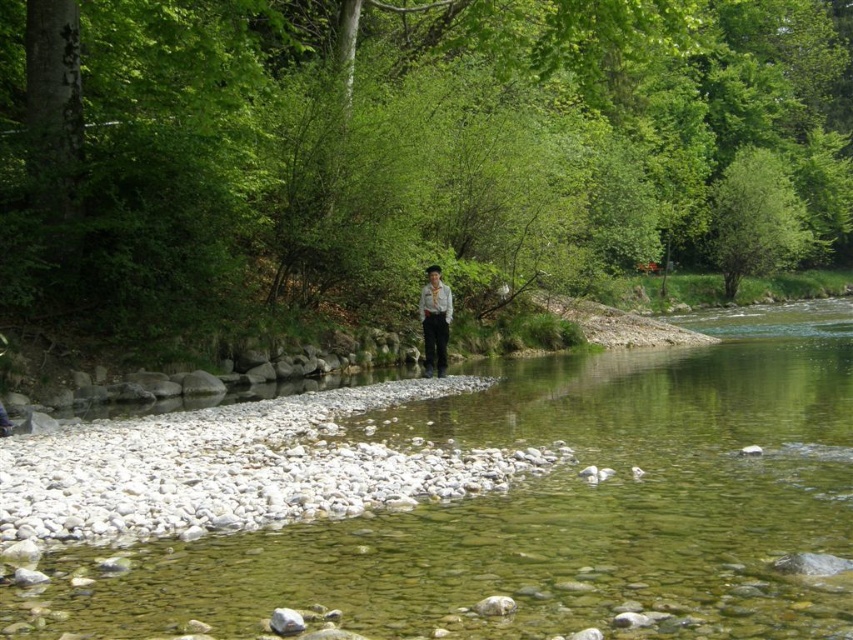
Question: Does clear water at center lie in front of light brown fabric shirt at center?

Choices:
 (A) yes
 (B) no

Answer: (A)

Question: Is clear water at center further to camera compared to light brown fabric shirt at center?

Choices:
 (A) yes
 (B) no

Answer: (B)

Question: From the image, what is the correct spatial relationship of clear water at center in relation to light brown fabric shirt at center?

Choices:
 (A) right
 (B) left

Answer: (A)

Question: Which point appears closest to the camera in this image?

Choices:
 (A) (432, 330)
 (B) (735, 397)

Answer: (B)

Question: Which point is farther from the camera taking this photo?

Choices:
 (A) (526, 412)
 (B) (448, 296)

Answer: (B)